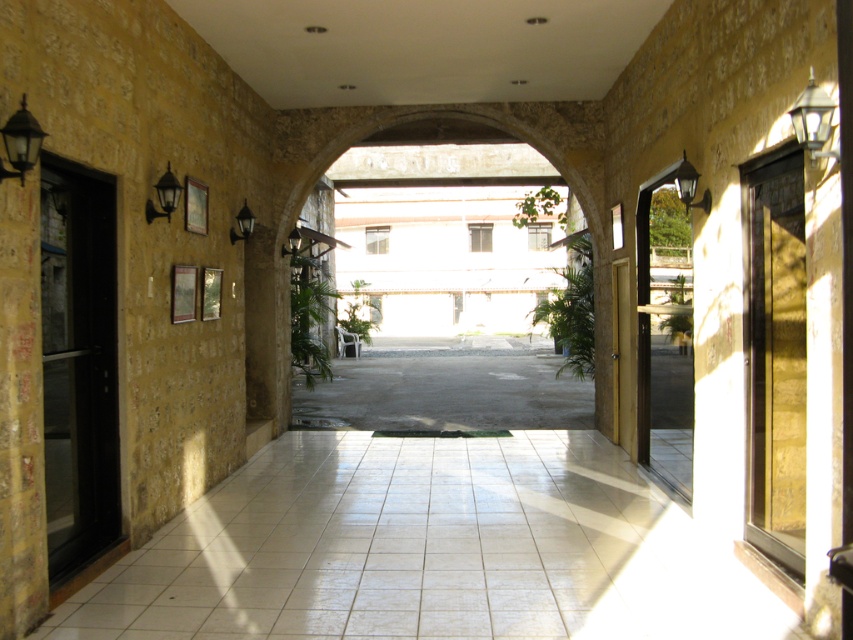
You are standing at the entrance of the walkway and want to hang a new picture exactly halfway between the entrance and the matte black lamp at upper right. What coordinate should you aim for?

The matte black lamp at upper right is located at coordinate point (689, 186). To find the halfway point between the entrance and the lamp, you would calculate the midpoint between the entrance coordinates and the lamp coordinates. However, without knowing the entrance coordinates, it is impossible to determine the exact halfway point.

You are a maintenance worker inspecting the covered walkway. You notice two lamps on the left side of the walkway. The first is the black matte lamp at left, and the second is the matte black lamp at upper left. Which lamp takes up more space in the walkway?

The matte black lamp at upper left takes up more space in the walkway than the black matte lamp at left because the black matte lamp at left occupies less space than matte black lamp at upper left.

You are a maintenance worker needing to replace a lightbulb. You are standing at the entrance of the walkway. Which lamp should you approach first if you want to minimize the distance you walk? The matte black lamp at upper right and the matte black wall lamp at upper left are both in need of replacement.

You should approach the matte black wall lamp at upper left first because it is closer to the entrance of the walkway than the matte black lamp at upper right, so walking to it first would minimize the total distance traveled.